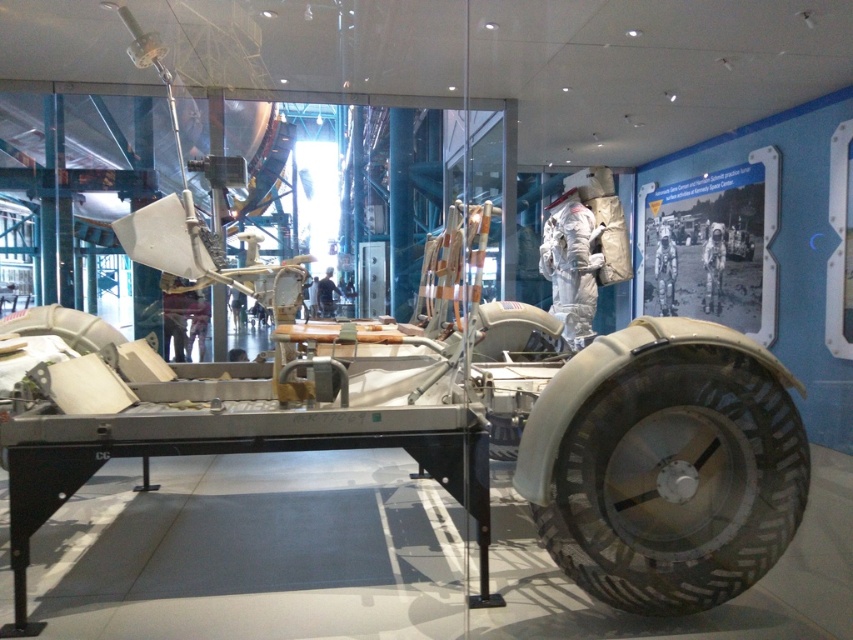
Between rubber textured tire at lower right and black fabric man at center, which one has less height?

black fabric man at center is shorter.

Is rubber textured tire at lower right wider than black fabric man at center?

Correct, the width of rubber textured tire at lower right exceeds that of black fabric man at center.

Which is in front, point (695, 605) or point (329, 289)?

Positioned in front is point (695, 605).

Image resolution: width=853 pixels, height=640 pixels. In order to click on rubber textured tire at lower right in this screenshot , I will do `click(676, 481)`.

In the scene shown: Is white spacesuit at center shorter than black fabric man at center?

In fact, white spacesuit at center may be taller than black fabric man at center.

Is white spacesuit at center positioned before black fabric man at center?

That is True.

Describe the element at coordinates (665, 269) in the screenshot. I see `white spacesuit at center` at that location.

Where is `white spacesuit at center`? This screenshot has width=853, height=640. white spacesuit at center is located at coordinates (665, 269).

How far apart are rubber textured tire at lower right and white spacesuit at center?

rubber textured tire at lower right is 4.87 meters away from white spacesuit at center.

This screenshot has height=640, width=853. What do you see at coordinates (676, 481) in the screenshot? I see `rubber textured tire at lower right` at bounding box center [676, 481].

Image resolution: width=853 pixels, height=640 pixels. I want to click on rubber textured tire at lower right, so click(x=676, y=481).